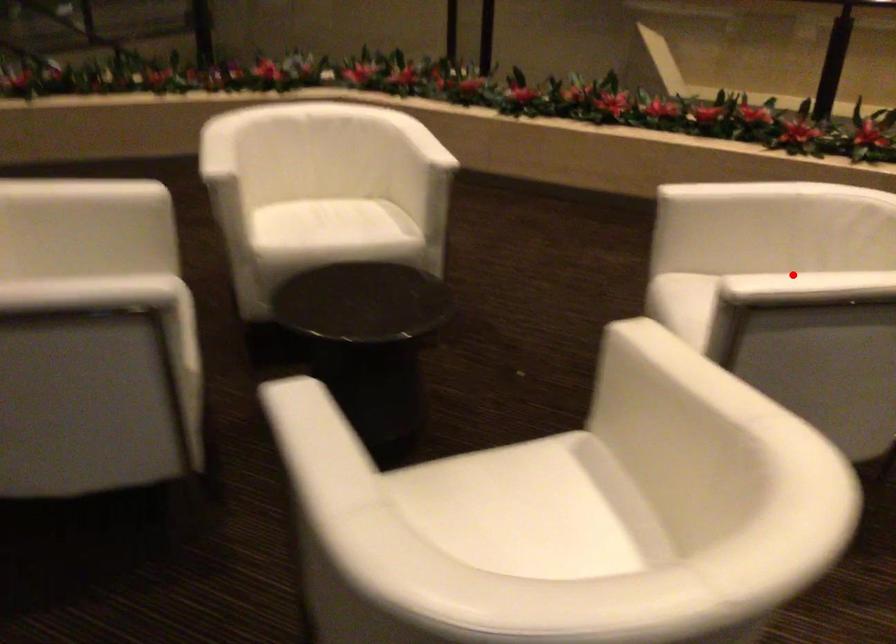
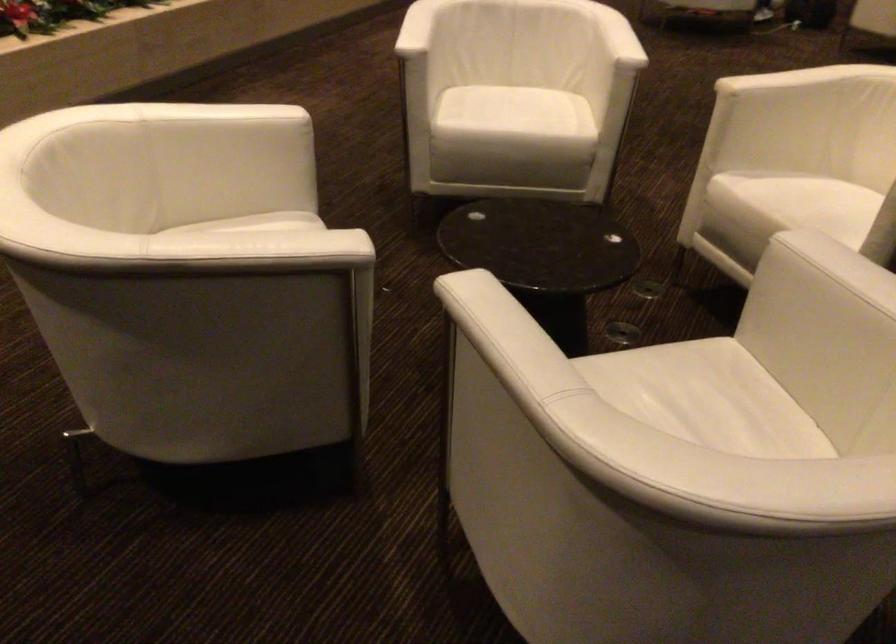
Find the pixel in the second image that matches the highlighted location in the first image.

(617, 37)